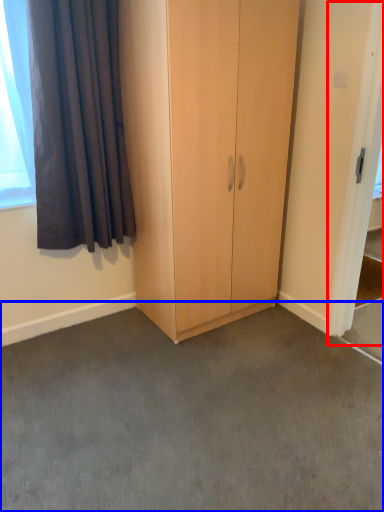
Question: Which point is further to the camera, screen door (highlighted by a red box) or concrete (highlighted by a blue box)?

Choices:
 (A) screen door
 (B) concrete

Answer: (A)